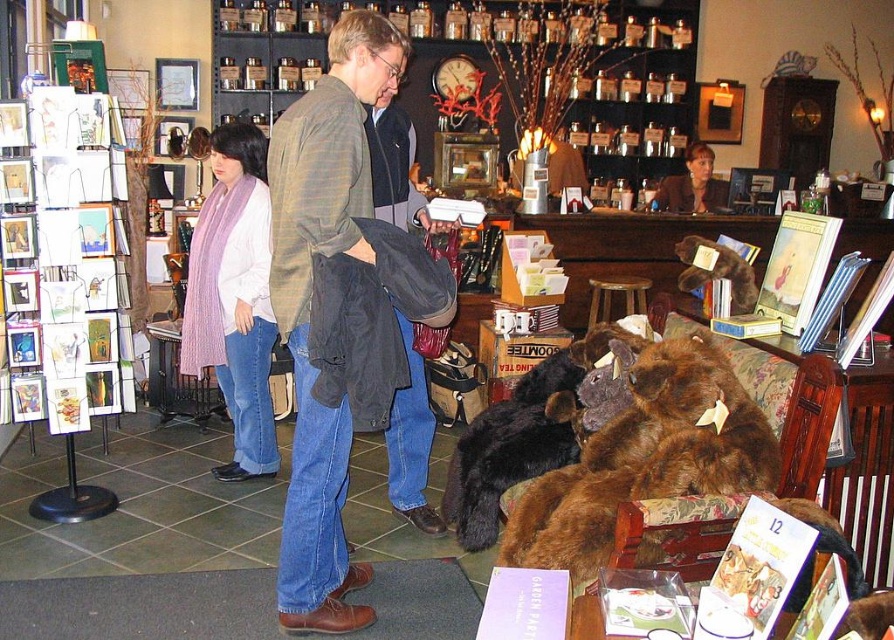
Between point (310, 172) and point (648, 282), which one is positioned in front?

Positioned in front is point (310, 172).

Which is behind, point (301, 492) or point (605, 278)?

Point (605, 278)

Where is `green plaid shirt at center`? The height and width of the screenshot is (640, 894). green plaid shirt at center is located at coordinates (308, 298).

Does green plaid shirt at center come in front of purple striped scarf at left?

Yes, green plaid shirt at center is in front of purple striped scarf at left.

Between point (336, 413) and point (255, 444), which one is positioned in front?

Positioned in front is point (336, 413).

Find the location of a particular element. The image size is (894, 640). green plaid shirt at center is located at coordinates (308, 298).

Is point (260, 177) positioned before point (621, 291)?

That is True.

Is purple striped scarf at left to the left of wooden stool at center from the viewer's perspective?

Indeed, purple striped scarf at left is positioned on the left side of wooden stool at center.

What do you see at coordinates (234, 298) in the screenshot? This screenshot has width=894, height=640. I see `purple striped scarf at left` at bounding box center [234, 298].

The height and width of the screenshot is (640, 894). In order to click on purple striped scarf at left in this screenshot , I will do (x=234, y=298).